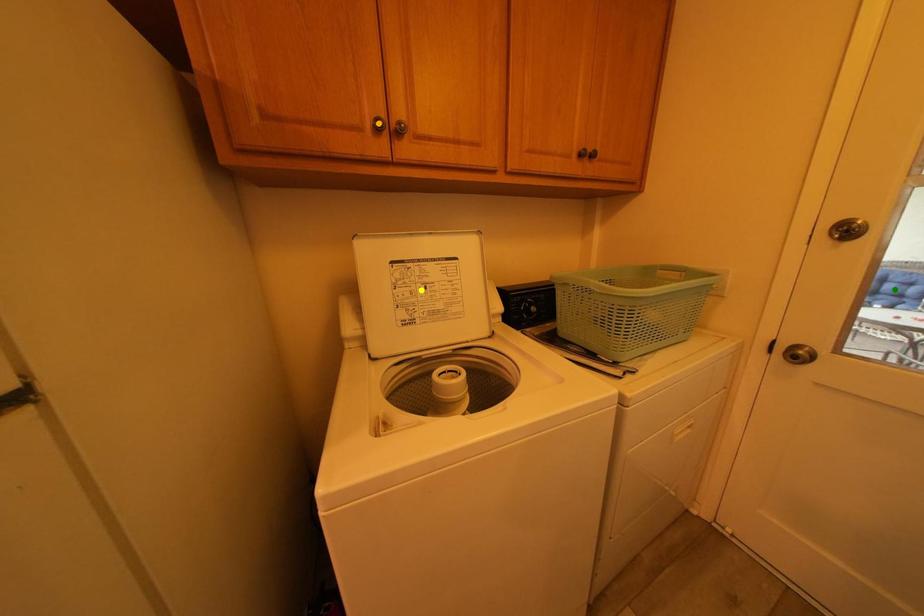
Order these from farthest to nearest:
yellow point, orange point, green point

green point → yellow point → orange point